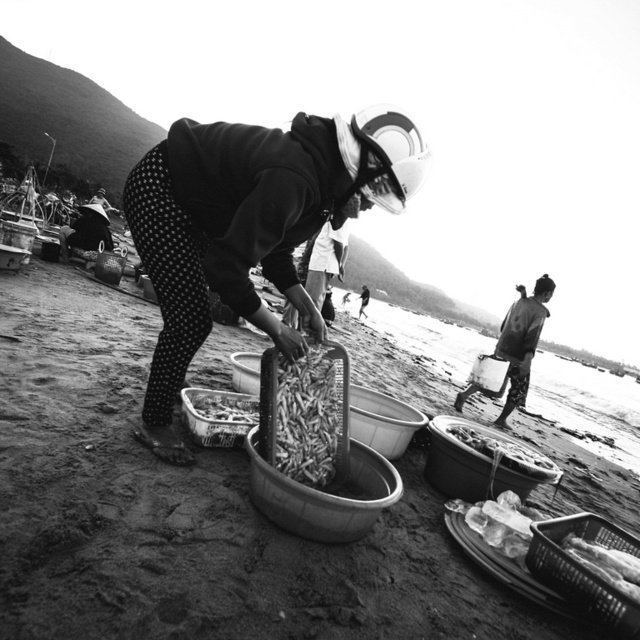
Question: Which point is closer to the camera taking this photo?

Choices:
 (A) (192, 204)
 (B) (586, 548)
 (C) (228, 419)

Answer: (A)

Question: Considering the relative positions of polka dot fabric pants at center and rustic woven basket at lower right in the image provided, where is polka dot fabric pants at center located with respect to rustic woven basket at lower right?

Choices:
 (A) left
 (B) right

Answer: (A)

Question: Among these points, which one is nearest to the camera?

Choices:
 (A) (624, 570)
 (B) (516, 452)
 (C) (236, 392)

Answer: (A)

Question: Does rustic woven basket at lower right have a lesser width compared to shiny metallic tray at center?

Choices:
 (A) yes
 (B) no

Answer: (B)

Question: Which of the following is the closest to the observer?

Choices:
 (A) (288, 275)
 (B) (584, 560)
 (C) (499, 438)
 (D) (548, 586)

Answer: (D)

Question: Is smooth plastic basket at lower right thinner than translucent plastic basket at lower right?

Choices:
 (A) yes
 (B) no

Answer: (B)